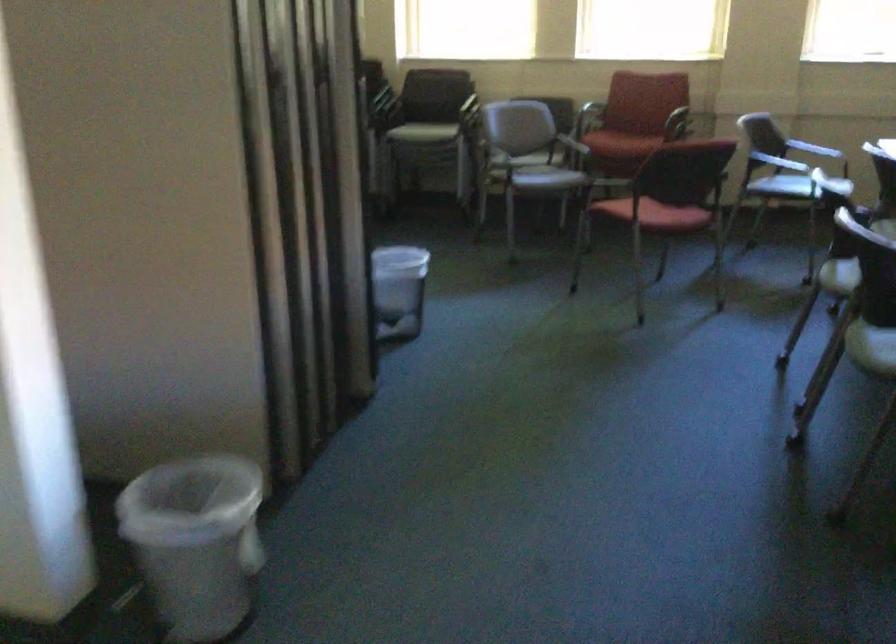
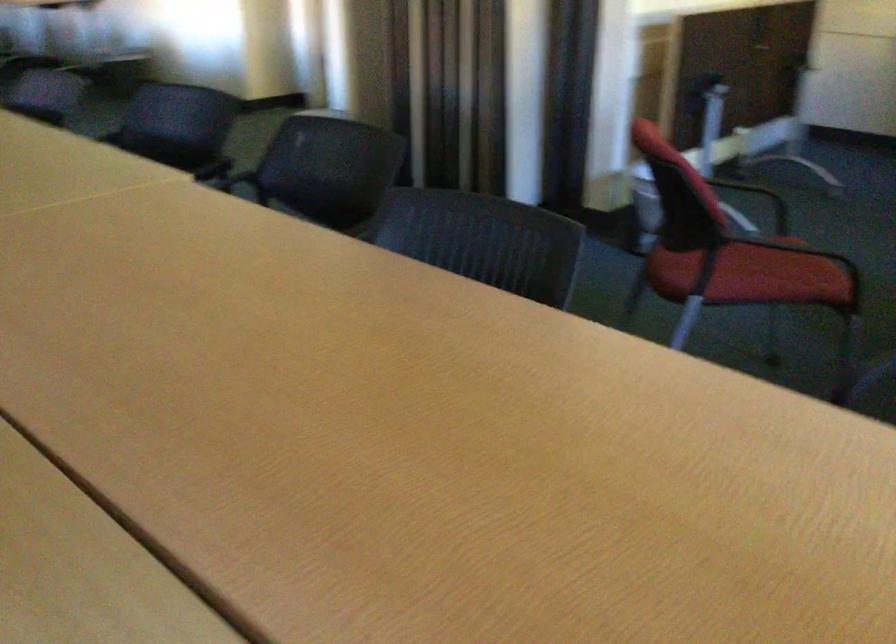
Question: I am providing you with two images of the same scene from different viewpoints. Please identify which objects are invisible in image2.

Choices:
 (A) monitor power button
 (B) chair sitting surface
 (C) red chair sitting surface
 (D) black chair armrest

Answer: (B)